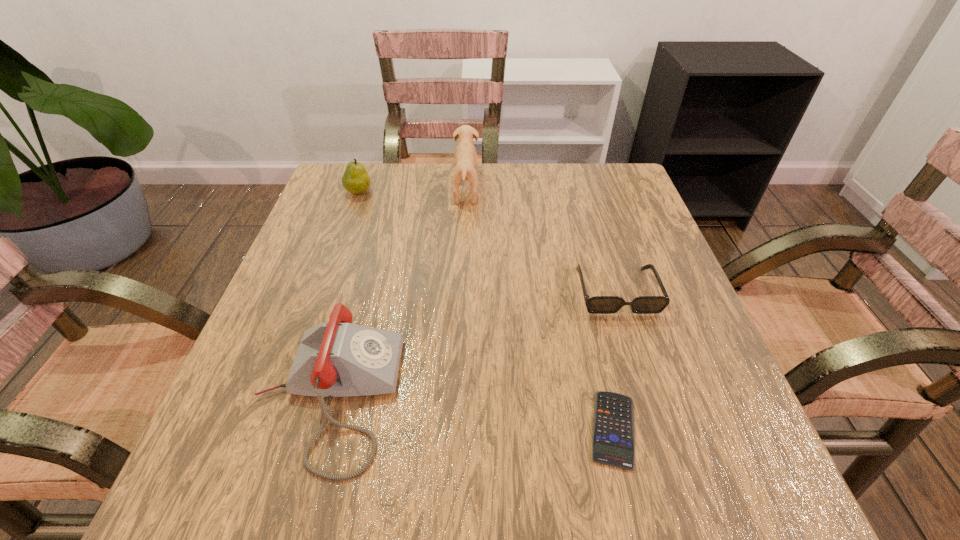
The image size is (960, 540). In order to click on the tallest object in this screenshot , I will do `click(465, 154)`.

Image resolution: width=960 pixels, height=540 pixels. Identify the location of puppy. (465, 154).

Image resolution: width=960 pixels, height=540 pixels. Find the location of `pear`. pear is located at coordinates (355, 180).

The image size is (960, 540). In order to click on telephone in this screenshot , I will do `click(336, 359)`.

I want to click on the third nearest object, so click(598, 304).

Locate an element on the screen. This screenshot has width=960, height=540. sunglasses is located at coordinates 598,304.

You are a GUI agent. You are given a task and a screenshot of the screen. Output one action in this format:
    pyautogui.click(x=<x>, y=<y>)
    Task: Click on the calculator
    This screenshot has height=540, width=960.
    Given the screenshot: What is the action you would take?
    pyautogui.click(x=613, y=437)

You are a GUI agent. You are given a task and a screenshot of the screen. Output one action in this format:
    pyautogui.click(x=<x>, y=<y>)
    Task: Click on the free space located on the left side of the tallest object
    Image resolution: width=960 pixels, height=540 pixels.
    Given the screenshot: What is the action you would take?
    pyautogui.click(x=502, y=190)

Identify the location of free space located 0.190m on the front of the pear. Image resolution: width=960 pixels, height=540 pixels. (339, 249).

Find the location of `vacant space located on the dial of the telephone`. vacant space located on the dial of the telephone is located at coordinates (622, 396).